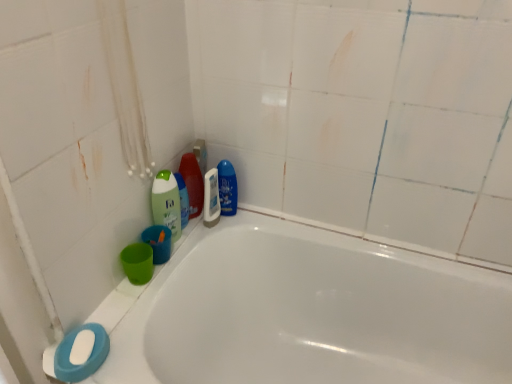
Where is `free point to the right of blue glossy bottle at upper center, which appears as the fourth cleaning product when viewed from the left`? This screenshot has height=384, width=512. free point to the right of blue glossy bottle at upper center, which appears as the fourth cleaning product when viewed from the left is located at coordinates (269, 221).